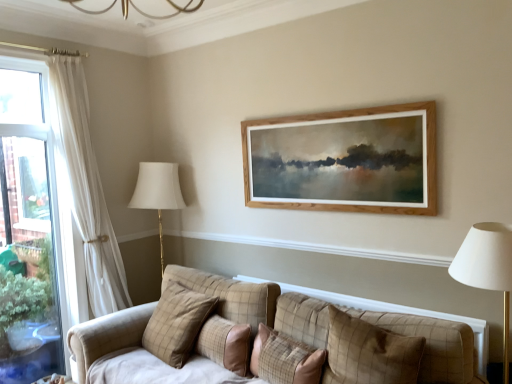
You are a GUI agent. You are given a task and a screenshot of the screen. Output one action in this format:
    pyautogui.click(x=<x>, y=<y>)
    Task: Click on the plaid fabric pillow at center, which ranks as the 4th pillow in left-to-right order
    
    Given the screenshot: What is the action you would take?
    pyautogui.click(x=369, y=352)

You are a GUI agent. You are given a task and a screenshot of the screen. Output one action in this format:
    pyautogui.click(x=<x>, y=<y>)
    Task: Click on the plaid fabric pillow at center, acting as the 1th pillow starting from the left
    
    Given the screenshot: What is the action you would take?
    pyautogui.click(x=177, y=323)

Describe the element at coordinates (285, 359) in the screenshot. I see `plaid fabric pillow at center, which is the second pillow from right to left` at that location.

Find the location of `plaid fabric pillow at center, which ranks as the 4th pillow in left-to-right order`. plaid fabric pillow at center, which ranks as the 4th pillow in left-to-right order is located at coordinates (369, 352).

From the image's perspective, is plaid fabric pillow at center, the third pillow in the right-to-left sequence, on top of plaid fabric pillow at center, the third pillow viewed from the left?

Yes, from the image's perspective, plaid fabric pillow at center, the third pillow in the right-to-left sequence, is above plaid fabric pillow at center, the third pillow viewed from the left.

Does plaid fabric pillow at center, the second pillow when ordered from left to right, have a lesser width compared to plaid fabric pillow at center, which is the second pillow from right to left?

Yes.

Between plaid fabric pillow at center, the third pillow in the right-to-left sequence, and plaid fabric pillow at center, the third pillow viewed from the left, which one has more height?

plaid fabric pillow at center, the third pillow viewed from the left, is taller.

You are a GUI agent. You are given a task and a screenshot of the screen. Output one action in this format:
    pyautogui.click(x=<x>, y=<y>)
    Task: Click on the 1st pillow positioned above the plaid fabric pillow at center, the third pillow viewed from the left (from a real-world perspective)
    This screenshot has height=384, width=512.
    Given the screenshot: What is the action you would take?
    pyautogui.click(x=225, y=344)

How many degrees apart are the facing directions of plaid fabric pillow at center, the third pillow in the right-to-left sequence, and plaid fabric pillow at center, which ranks as the 4th pillow in left-to-right order?

There is a 3.3-degree angle between the facing directions of plaid fabric pillow at center, the third pillow in the right-to-left sequence, and plaid fabric pillow at center, which ranks as the 4th pillow in left-to-right order.

Considering the sizes of objects plaid fabric pillow at center, the third pillow in the right-to-left sequence, and plaid fabric pillow at center, the first pillow from the right, in the image provided, who is shorter, plaid fabric pillow at center, the third pillow in the right-to-left sequence, or plaid fabric pillow at center, the first pillow from the right,?

Standing shorter between the two is plaid fabric pillow at center, the third pillow in the right-to-left sequence.

Would you say plaid fabric pillow at center, the third pillow in the right-to-left sequence, is to the left or to the right of plaid fabric pillow at center, which ranks as the 4th pillow in left-to-right order, in the picture?

In the image, plaid fabric pillow at center, the third pillow in the right-to-left sequence, appears on the left side of plaid fabric pillow at center, which ranks as the 4th pillow in left-to-right order.

Can you confirm if plaid fabric pillow at center, which is the second pillow from right to left, is wider than plaid fabric pillow at center, which ranks as the 4th pillow in left-to-right order?

Yes, plaid fabric pillow at center, which is the second pillow from right to left, is wider than plaid fabric pillow at center, which ranks as the 4th pillow in left-to-right order.

Is plaid fabric pillow at center, which ranks as the 4th pillow in left-to-right order, surrounded by plaid fabric pillow at center, the third pillow viewed from the left?

No, plaid fabric pillow at center, which ranks as the 4th pillow in left-to-right order, is not surrounded by plaid fabric pillow at center, the third pillow viewed from the left.

Is plaid fabric pillow at center, the third pillow viewed from the left, smaller than plaid fabric pillow at center, which ranks as the 4th pillow in left-to-right order?

No, plaid fabric pillow at center, the third pillow viewed from the left, is not smaller than plaid fabric pillow at center, which ranks as the 4th pillow in left-to-right order.

Can you tell me how much plaid fabric pillow at center, which is the second pillow from right to left, and plaid fabric pillow at center, which ranks as the 4th pillow in left-to-right order, differ in facing direction?

plaid fabric pillow at center, which is the second pillow from right to left, and plaid fabric pillow at center, which ranks as the 4th pillow in left-to-right order, are facing 0.592 degrees away from each other.

From a real-world perspective, is plaid fabric pillow at center, the first pillow from the right, positioned over plaid fabric pillow at center, acting as the 1th pillow starting from the left, based on gravity?

Yes, from a real-world perspective, plaid fabric pillow at center, the first pillow from the right, is on top of plaid fabric pillow at center, acting as the 1th pillow starting from the left.

From the image's perspective, relative to plaid fabric pillow at center, which is counted as the fourth pillow, starting from the right, is plaid fabric pillow at center, which ranks as the 4th pillow in left-to-right order, above or below?

plaid fabric pillow at center, which ranks as the 4th pillow in left-to-right order, is situated higher than plaid fabric pillow at center, which is counted as the fourth pillow, starting from the right, in the image.

Which is correct: plaid fabric pillow at center, the first pillow from the right, is inside plaid fabric pillow at center, which is counted as the fourth pillow, starting from the right, or outside of it?

plaid fabric pillow at center, the first pillow from the right, is spatially situated outside plaid fabric pillow at center, which is counted as the fourth pillow, starting from the right.

Considering the positions of points (339, 327) and (155, 318), is point (339, 327) farther from camera compared to point (155, 318)?

No.

How many degrees apart are the facing directions of plaid fabric pillow at center, the first pillow from the right, and plaid fabric pillow at center, the third pillow in the right-to-left sequence?

There is a 3.3-degree angle between the facing directions of plaid fabric pillow at center, the first pillow from the right, and plaid fabric pillow at center, the third pillow in the right-to-left sequence.

Who is bigger, plaid fabric pillow at center, the first pillow from the right, or plaid fabric pillow at center, the third pillow in the right-to-left sequence?

plaid fabric pillow at center, the first pillow from the right, is bigger.

From the image's perspective, which is below, plaid fabric pillow at center, which ranks as the 4th pillow in left-to-right order, or plaid fabric pillow at center, the second pillow when ordered from left to right?

plaid fabric pillow at center, the second pillow when ordered from left to right.

From the plaid fabric pillow at center, the third pillow in the right-to-left sequence, count 2nd pillows forward and point to it. Please provide its 2D coordinates.

[(369, 352)]

From the image's perspective, between plaid fabric pillow at center, the third pillow in the right-to-left sequence, and plaid fabric pillow at center, acting as the 1th pillow starting from the left, which one is located above?

plaid fabric pillow at center, acting as the 1th pillow starting from the left, is shown above in the image.

Is plaid fabric pillow at center, acting as the 1th pillow starting from the left, completely or partially inside plaid fabric pillow at center, the second pillow when ordered from left to right?

No.

Is plaid fabric pillow at center, the second pillow when ordered from left to right, turned away from plaid fabric pillow at center, acting as the 1th pillow starting from the left?

No.

Could you measure the distance between plaid fabric pillow at center, the first pillow from the right, and plaid fabric pillow at center, the third pillow viewed from the left?

10.70 inches.

Is plaid fabric pillow at center, the third pillow viewed from the left, at the back of plaid fabric pillow at center, the first pillow from the right?

No, plaid fabric pillow at center, the first pillow from the right, is not facing away from plaid fabric pillow at center, the third pillow viewed from the left.

In the scene shown: Are plaid fabric pillow at center, the first pillow from the right, and plaid fabric pillow at center, the third pillow viewed from the left, making contact?

No, plaid fabric pillow at center, the first pillow from the right, is not touching plaid fabric pillow at center, the third pillow viewed from the left.

The image size is (512, 384). I want to click on the 3rd pillow above when counting from the plaid fabric pillow at center, the third pillow viewed from the left (from the image's perspective), so pyautogui.click(x=369, y=352).

Locate an element on the screen. The height and width of the screenshot is (384, 512). pillow that is the 1st one when counting leftward from the plaid fabric pillow at center, which is the second pillow from right to left is located at coordinates (225, 344).

Image resolution: width=512 pixels, height=384 pixels. In order to click on pillow that is the 2nd one when counting rightward from the plaid fabric pillow at center, the third pillow in the right-to-left sequence in this screenshot , I will do `click(369, 352)`.

Considering their positions, is plaid fabric pillow at center, the first pillow from the right, positioned further to plaid fabric pillow at center, the second pillow when ordered from left to right, than plaid fabric pillow at center, which is counted as the fourth pillow, starting from the right?

plaid fabric pillow at center, the first pillow from the right, is further to plaid fabric pillow at center, the second pillow when ordered from left to right.

From the image, which object appears to be nearer to plaid fabric pillow at center, acting as the 1th pillow starting from the left, plaid fabric pillow at center, the second pillow when ordered from left to right, or plaid fabric pillow at center, which is the second pillow from right to left?

Among the two, plaid fabric pillow at center, the second pillow when ordered from left to right, is located nearer to plaid fabric pillow at center, acting as the 1th pillow starting from the left.

Looking at the image, which one is located closer to plaid fabric pillow at center, which ranks as the 4th pillow in left-to-right order, plaid fabric pillow at center, the third pillow in the right-to-left sequence, or plaid fabric pillow at center, the third pillow viewed from the left?

plaid fabric pillow at center, the third pillow viewed from the left, lies closer to plaid fabric pillow at center, which ranks as the 4th pillow in left-to-right order, than the other object.

Considering their positions, is plaid fabric pillow at center, the first pillow from the right, positioned closer to plaid fabric pillow at center, acting as the 1th pillow starting from the left, than plaid fabric pillow at center, the third pillow in the right-to-left sequence?

plaid fabric pillow at center, the third pillow in the right-to-left sequence, lies closer to plaid fabric pillow at center, acting as the 1th pillow starting from the left, than the other object.

Estimate the real-world distances between objects in this image. Which object is further from plaid fabric pillow at center, the third pillow viewed from the left, plaid fabric pillow at center, the first pillow from the right, or plaid fabric pillow at center, acting as the 1th pillow starting from the left?

plaid fabric pillow at center, acting as the 1th pillow starting from the left, lies further to plaid fabric pillow at center, the third pillow viewed from the left, than the other object.

Looking at the image, which one is located further to plaid fabric pillow at center, the first pillow from the right, plaid fabric pillow at center, the third pillow viewed from the left, or plaid fabric pillow at center, which is counted as the fourth pillow, starting from the right?

Among the two, plaid fabric pillow at center, which is counted as the fourth pillow, starting from the right, is located further to plaid fabric pillow at center, the first pillow from the right.

When comparing their distances from plaid fabric pillow at center, the third pillow in the right-to-left sequence, does plaid fabric pillow at center, acting as the 1th pillow starting from the left, or plaid fabric pillow at center, the first pillow from the right, seem closer?

plaid fabric pillow at center, acting as the 1th pillow starting from the left.

When comparing their distances from plaid fabric pillow at center, the third pillow in the right-to-left sequence, does plaid fabric pillow at center, which is the second pillow from right to left, or plaid fabric pillow at center, which ranks as the 4th pillow in left-to-right order, seem closer?

plaid fabric pillow at center, which is the second pillow from right to left, lies closer to plaid fabric pillow at center, the third pillow in the right-to-left sequence, than the other object.

Identify the location of pillow between plaid fabric pillow at center, which is counted as the fourth pillow, starting from the right, and plaid fabric pillow at center, which is the second pillow from right to left, from left to right. (225, 344).

I want to click on pillow between plaid fabric pillow at center, the second pillow when ordered from left to right, and plaid fabric pillow at center, the first pillow from the right, in the horizontal direction, so click(x=285, y=359).